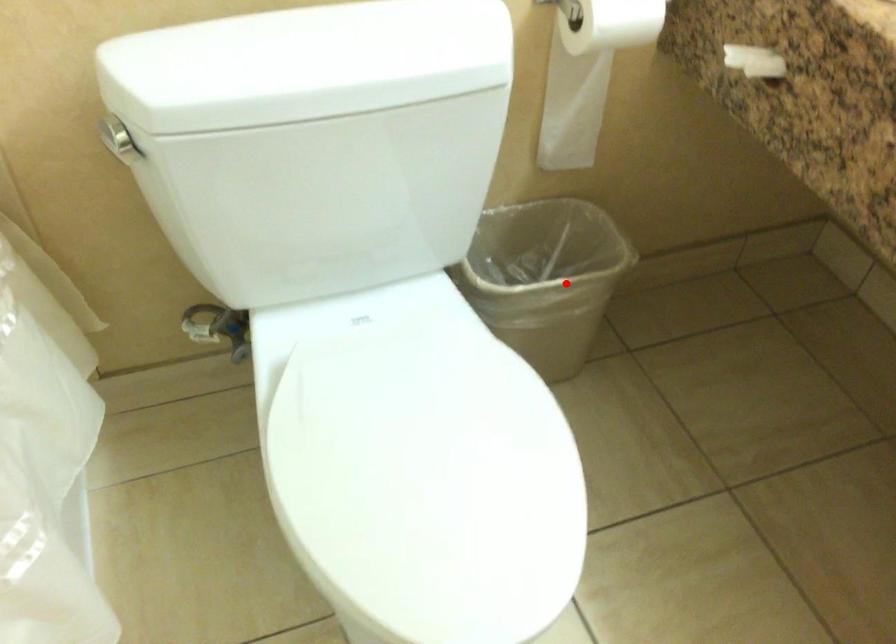
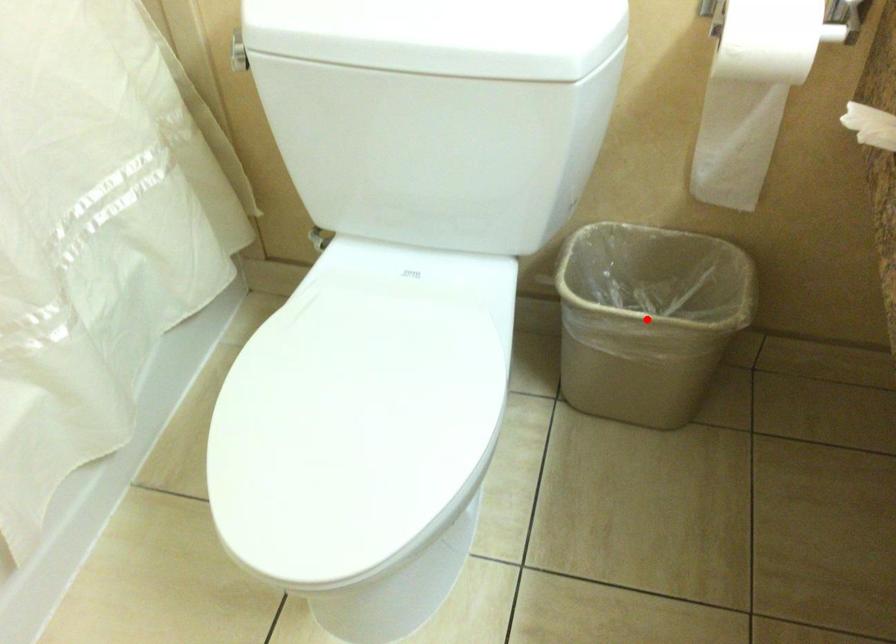
I am providing you with two images of the same scene from different viewpoints. A red point is marked on the first image and another point is marked on the second image. Are the points marked in image1 and image2 representing the same 3D position?

Yes